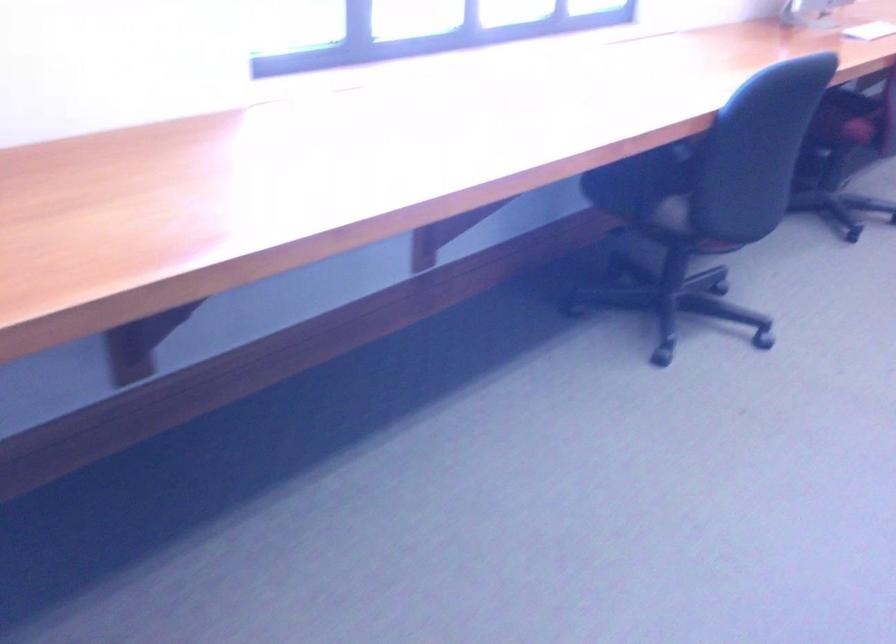
This screenshot has height=644, width=896. What do you see at coordinates (640, 181) in the screenshot? I see `the black chair sitting surface` at bounding box center [640, 181].